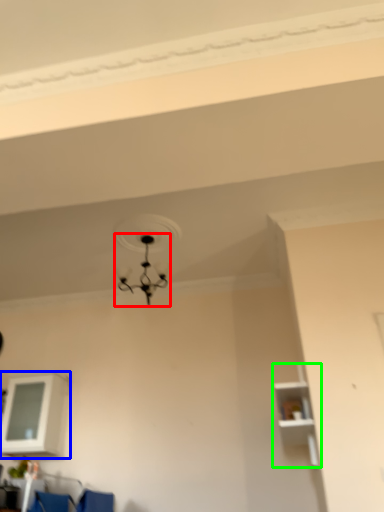
Question: Which is nearer to the lamp (highlighted by a red box)? shelf (highlighted by a blue box) or shelf (highlighted by a green box).

Choices:
 (A) shelf
 (B) shelf

Answer: (A)